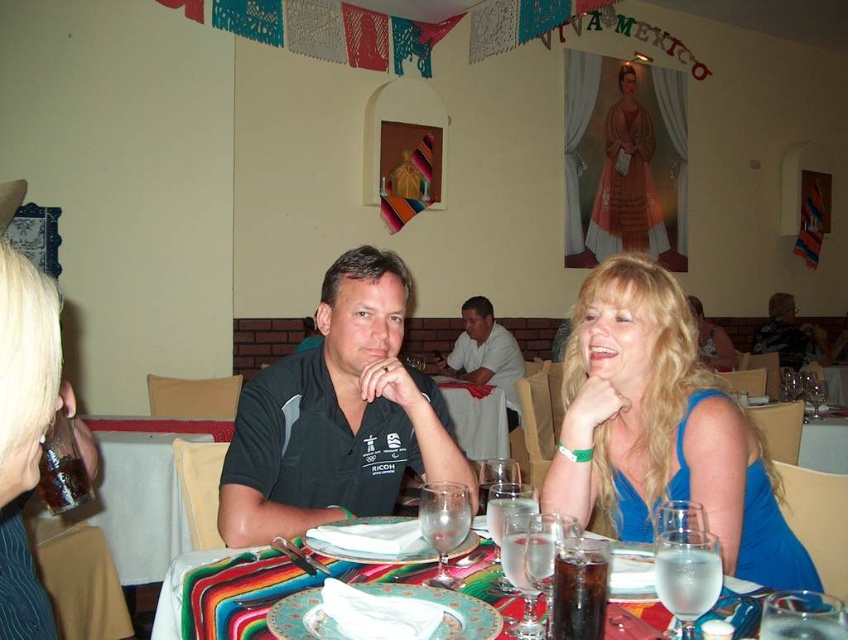
Measure the distance between matte black shirt at center and camera.

A distance of 4.51 meters exists between matte black shirt at center and camera.

Is matte black shirt at center to the left of translucent glass water at center from the viewer's perspective?

In fact, matte black shirt at center is to the right of translucent glass water at center.

This screenshot has width=848, height=640. What do you see at coordinates (484, 355) in the screenshot?
I see `matte black shirt at center` at bounding box center [484, 355].

Locate an element on the screen. matte black shirt at center is located at coordinates (484, 355).

Between black matte shirt at center and matte black shirt at center, which one appears on the right side from the viewer's perspective?

Positioned to the right is matte black shirt at center.

Is point (377, 371) farther from camera compared to point (467, 381)?

That is False.

Find the location of `black matte shirt at center`. black matte shirt at center is located at coordinates (338, 417).

Where is `black matte shirt at center`? The width and height of the screenshot is (848, 640). black matte shirt at center is located at coordinates (338, 417).

Which is behind, point (255, 378) or point (721, 356)?

Positioned behind is point (721, 356).

This screenshot has height=640, width=848. What are the coordinates of `black matte shirt at center` in the screenshot? It's located at (338, 417).